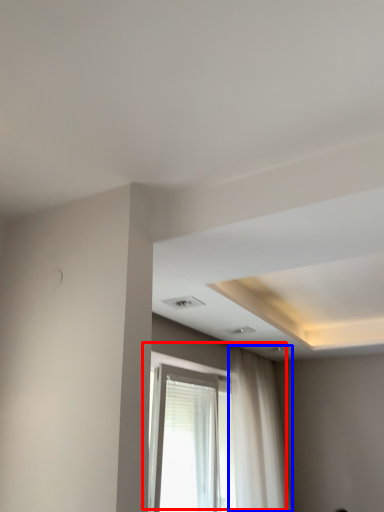
Question: Which of the following is the farthest to the observer, window (highlighted by a red box) or curtain (highlighted by a blue box)?

Choices:
 (A) window
 (B) curtain

Answer: (B)